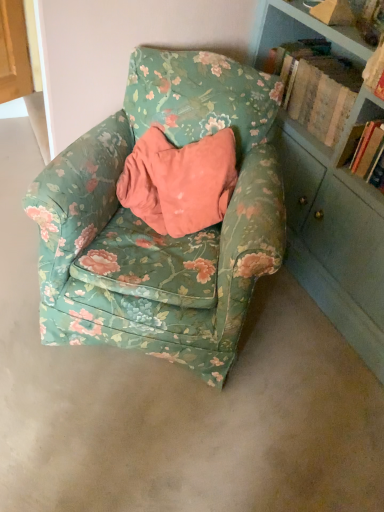
Find the location of a particular element. This screenshot has height=512, width=384. free location in front of floral fabric armchair at center is located at coordinates (145, 428).